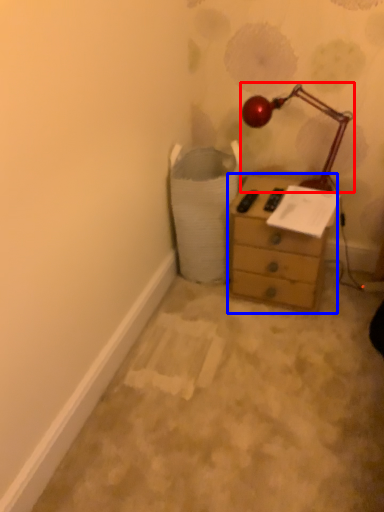
Question: Which object appears closest to the camera in this image, lamp (highlighted by a red box) or chest of drawers (highlighted by a blue box)?

Choices:
 (A) lamp
 (B) chest of drawers

Answer: (A)